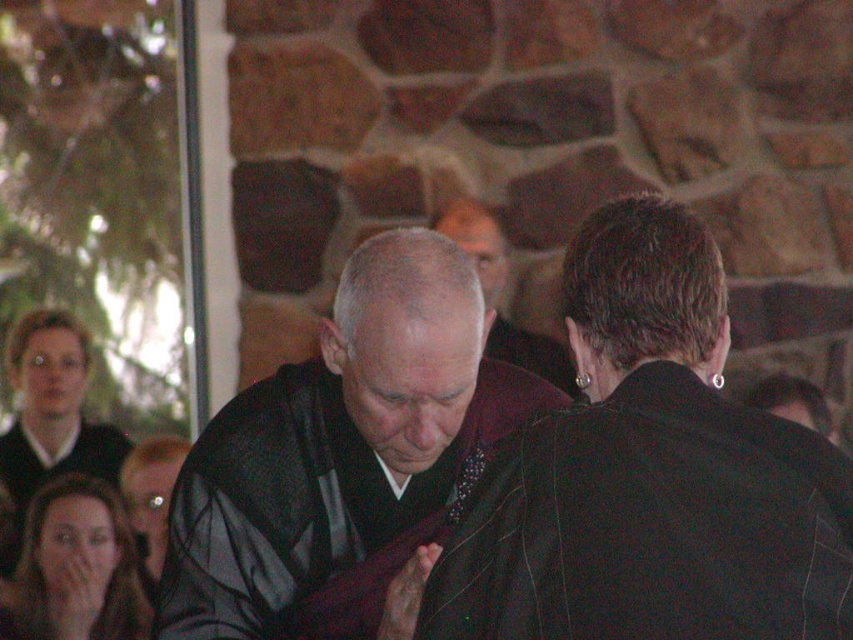
Question: Can you confirm if black silk robe at center is smaller than dark gray robe at center?

Choices:
 (A) no
 (B) yes

Answer: (A)

Question: Based on their relative distances, which object is nearer to the dark brown leather robe at center?

Choices:
 (A) black silk robe at center
 (B) dark gray robe at center

Answer: (A)

Question: Which of the following is the closest to the observer?

Choices:
 (A) dark gray robe at center
 (B) black silk robe at center

Answer: (B)

Question: Does dark brown leather robe at center have a greater width compared to dark gray robe at center?

Choices:
 (A) no
 (B) yes

Answer: (B)

Question: Which of the following is the closest to the observer?

Choices:
 (A) (567, 392)
 (B) (647, 552)

Answer: (B)

Question: Considering the relative positions of dark brown leather robe at center and black silk robe at center in the image provided, where is dark brown leather robe at center located with respect to black silk robe at center?

Choices:
 (A) left
 (B) right

Answer: (B)